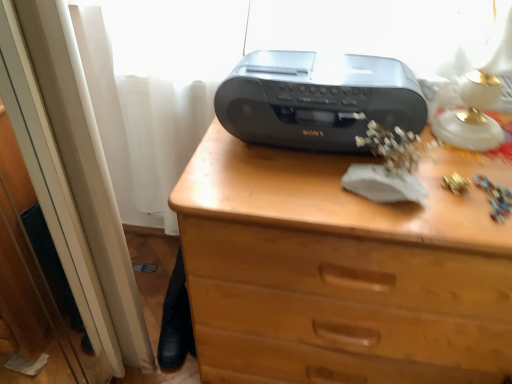
The width and height of the screenshot is (512, 384). I want to click on vacant region under white glossy table lamp at upper right (from a real-world perspective), so click(463, 150).